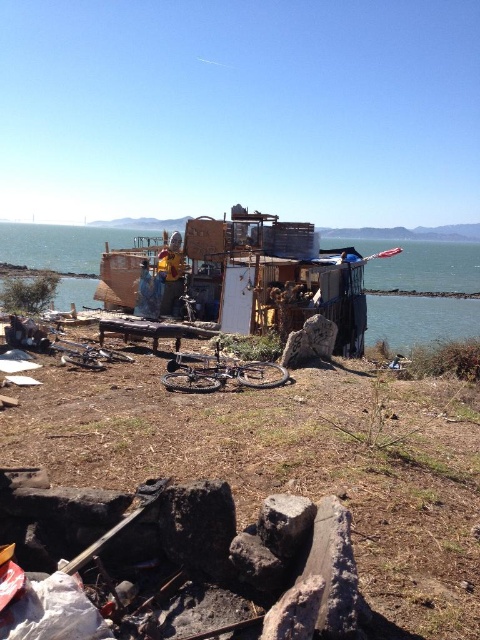
Question: Which point appears closest to the camera in this image?

Choices:
 (A) (64, 449)
 (B) (168, 262)

Answer: (A)

Question: Can you confirm if brown dirt at lower center is positioned above blue water at center?

Choices:
 (A) yes
 (B) no

Answer: (B)

Question: Does gray rough stone at center appear on the right side of yellow fabric shirt at center?

Choices:
 (A) yes
 (B) no

Answer: (A)

Question: Which object appears closest to the camera in this image?

Choices:
 (A) gray rough stone at center
 (B) blue water at center

Answer: (A)

Question: Which point appears farthest from the camera in this image?

Choices:
 (A) (52, 243)
 (B) (299, 529)
 (C) (252, 442)

Answer: (A)

Question: Does gray rough stone at center appear on the right side of yellow fabric shirt at center?

Choices:
 (A) no
 (B) yes

Answer: (B)